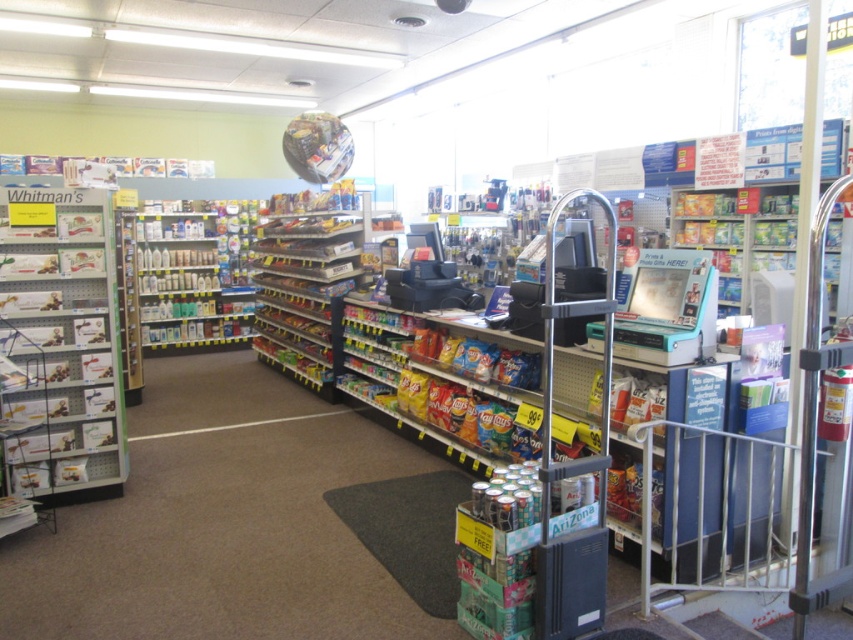
How much distance is there between metallic silver candy at left and white plastic bottles at left?

metallic silver candy at left and white plastic bottles at left are 4.71 meters apart from each other.

How far apart are metallic silver candy at left and white plastic bottles at left?

metallic silver candy at left and white plastic bottles at left are 4.71 meters apart.

You are a GUI agent. You are given a task and a screenshot of the screen. Output one action in this format:
    pyautogui.click(x=<x>, y=<y>)
    Task: Click on the metallic silver candy at left
    This screenshot has width=853, height=640.
    Given the screenshot: What is the action you would take?
    pyautogui.click(x=62, y=340)

At what (x,y) coordinates should I click in order to perform the action: click on metallic silver candy at left. Please return your answer as a coordinate pair (x, y). The height and width of the screenshot is (640, 853). Looking at the image, I should click on (62, 340).